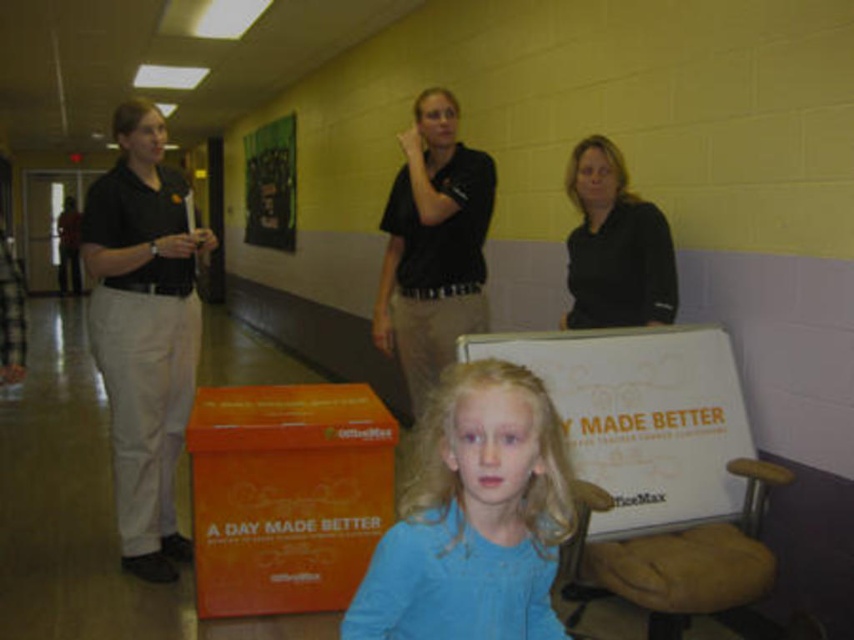
Where is the blue fabric shirt at center located in the image?

The blue fabric shirt at center is located at point 0.811 on the x axis and 0.556 on the y axis.

You are a delivery person who needs to place a package that is 1.5 meters long between the blue fabric shirt at center and the orange matte cardboard box at lower left. Can the package fit in the space between them?

The distance between the blue fabric shirt at center and the orange matte cardboard box at lower left is 1.52 meters, so the 1.5 meters long package can fit in the space between them.

You are organizing a small event and need to decide which item to place on a narrow shelf. The blue fabric shirt at center and the orange matte cardboard box at lower left are both candidates. Based on their sizes, which item would fit better on the shelf?

The blue fabric shirt at center has a smaller width than the orange matte cardboard box at lower left, so it would fit better on the narrow shelf.